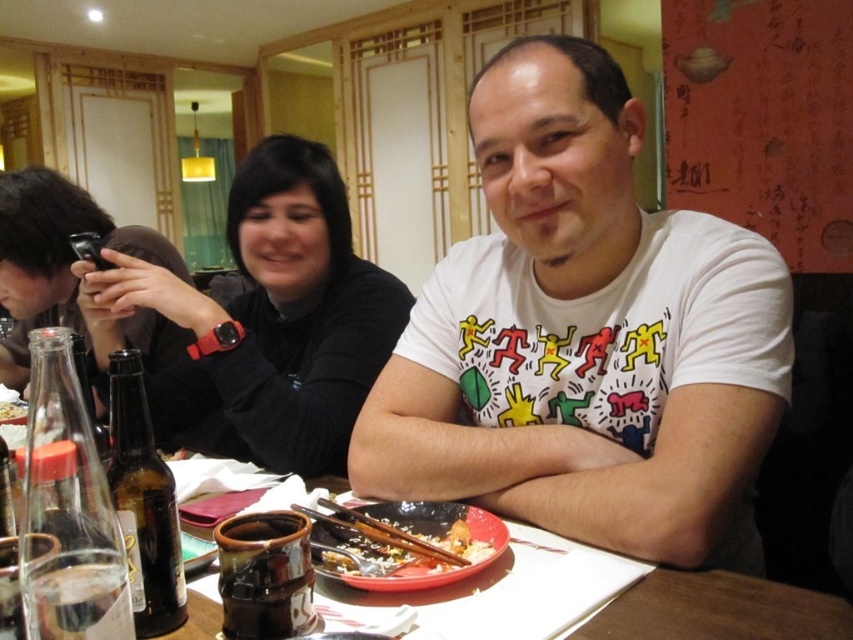
Can you confirm if shiny ceramic bowl at center is positioned to the left of white rice at center?

In fact, shiny ceramic bowl at center is to the right of white rice at center.

Based on the photo, which is above, shiny ceramic bowl at center or white rice at center?

white rice at center is above.

Who is more distant from viewer, (381,572) or (24,419)?

Point (24,419)

You are a GUI agent. You are given a task and a screenshot of the screen. Output one action in this format:
    pyautogui.click(x=<x>, y=<y>)
    Task: Click on the shiny ceramic bowl at center
    The height and width of the screenshot is (640, 853).
    Given the screenshot: What is the action you would take?
    [399, 547]

This screenshot has width=853, height=640. What are the coordinates of `clear glass bottle at lower left` in the screenshot? It's located at (73, 550).

Is brown glass bottle at lower left smaller than white rice at center?

No, brown glass bottle at lower left is not smaller than white rice at center.

Between brown glass bottle at lower left and white rice at center, which one appears on the right side from the viewer's perspective?

Positioned to the right is brown glass bottle at lower left.

Who is more distant from viewer, (144, 396) or (21, 404)?

Point (21, 404)

Identify the location of brown glass bottle at lower left. Image resolution: width=853 pixels, height=640 pixels. (143, 502).